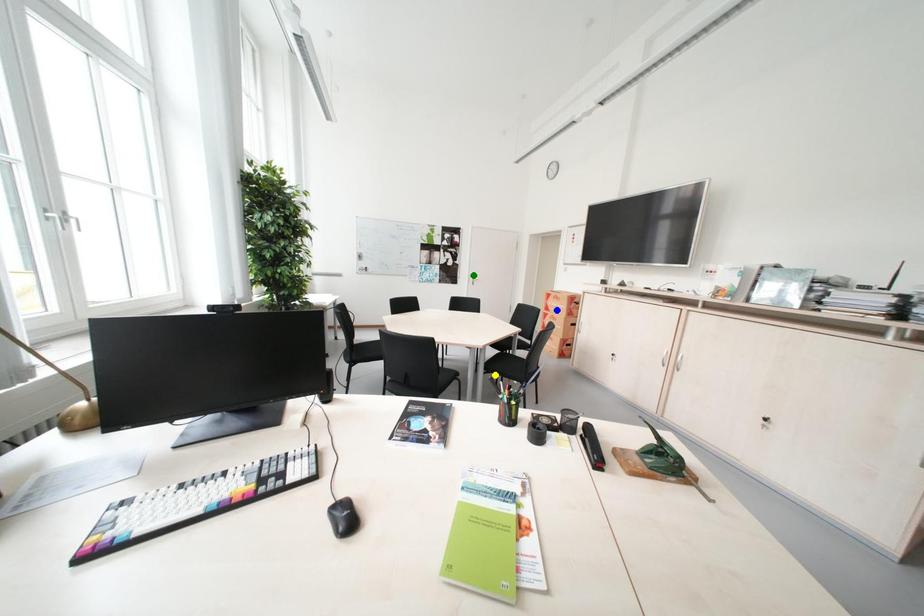
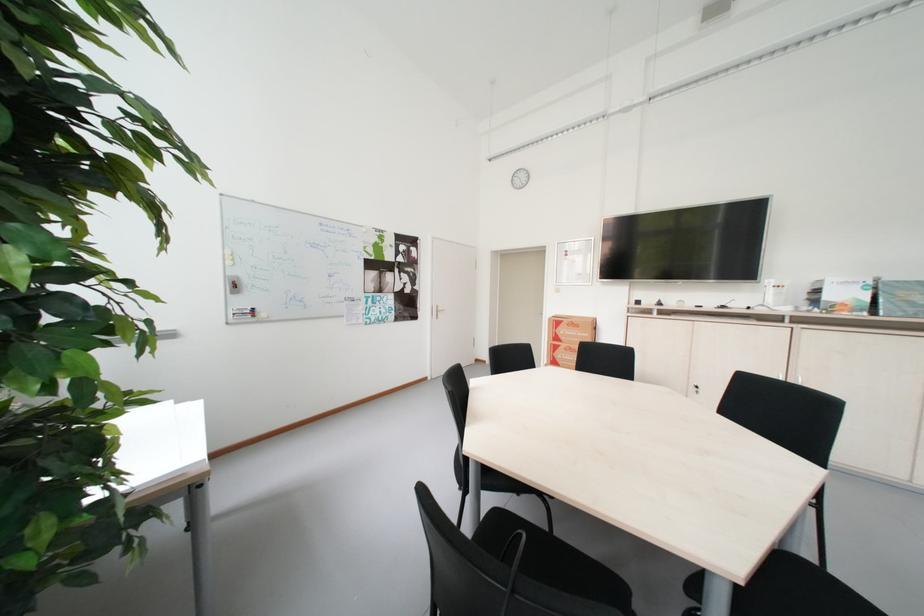
I am providing you with two images of the same scene from different viewpoints. Three points are marked in image1. Which point corresponds to a part or object that is occluded in image2?In image1, three points are marked. Which of them correspond to a part or object that is occluded in image2?Among the three points shown in image1, which one corresponds to a part or object that is no longer visible due to occlusion in image2?

yellow point cannot be seen in image2.